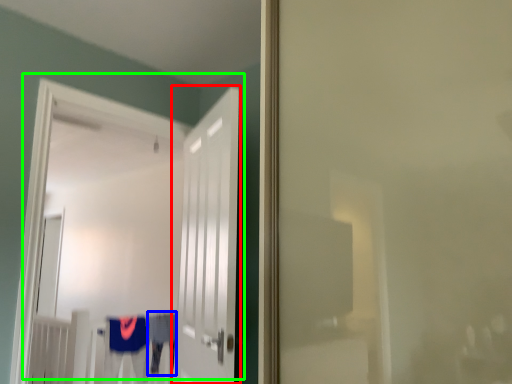
Question: Considering the real-world distances, which object is farthest from door (highlighted by a red box)? robe (highlighted by a blue box) or door (highlighted by a green box)?

Choices:
 (A) robe
 (B) door

Answer: (B)